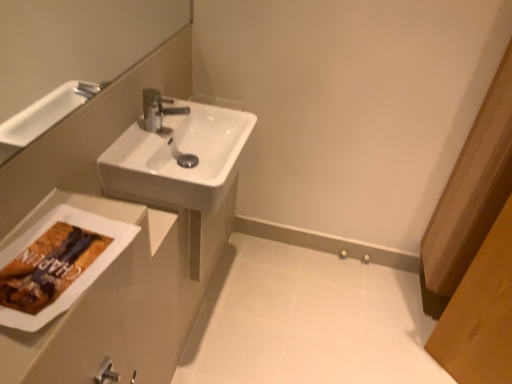
In order to click on vacant area on top of white glossy porcelain at center (from a real-world perspective) in this screenshot , I will do `click(314, 317)`.